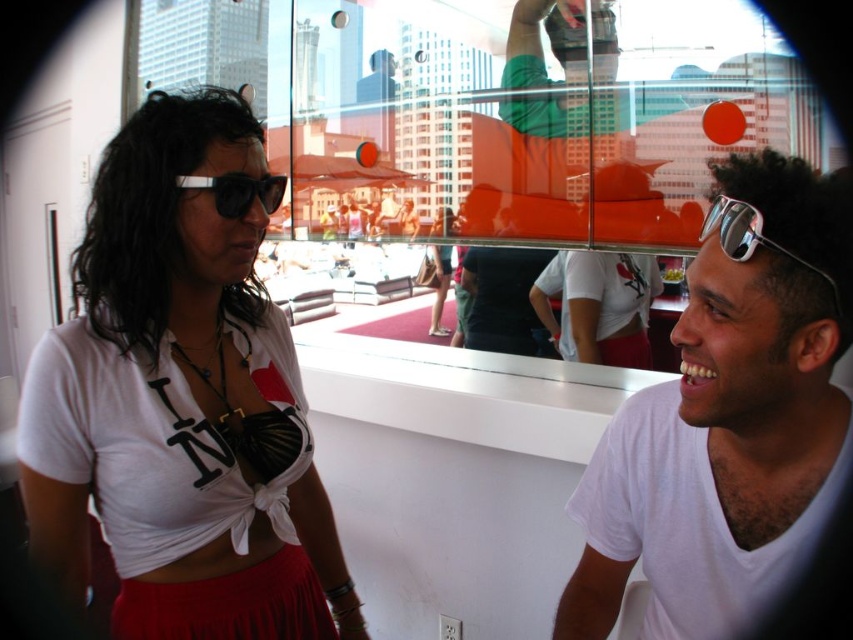
Question: Is silver reflective sunglasses at right thinner than matte black sunglasses at left?

Choices:
 (A) no
 (B) yes

Answer: (B)

Question: Can you confirm if white matte shirt at left is positioned to the left of silver reflective sunglasses at right?

Choices:
 (A) no
 (B) yes

Answer: (B)

Question: Which point is closer to the camera taking this photo?

Choices:
 (A) (682, 492)
 (B) (242, 372)
 (C) (247, 182)

Answer: (A)

Question: Does transparent glass window at upper center have a larger size compared to white matte shirt at right?

Choices:
 (A) no
 (B) yes

Answer: (B)

Question: Which point is farther from the camera taking this photo?

Choices:
 (A) (210, 99)
 (B) (213, 3)

Answer: (B)

Question: Which of the following is the closest to the observer?

Choices:
 (A) white matte shirt at left
 (B) silver reflective sunglasses at right

Answer: (B)